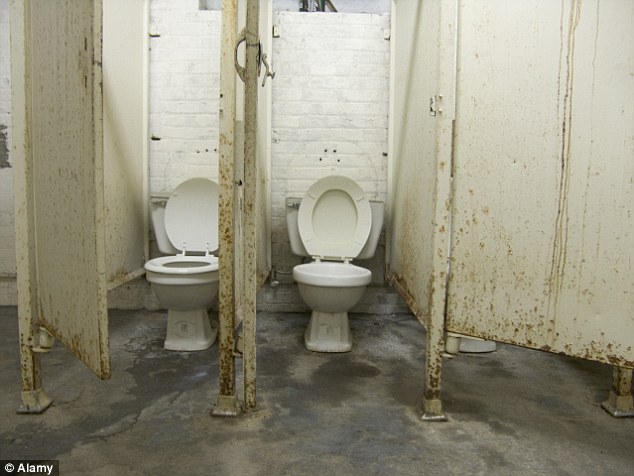
Where is `toilet lid`? This screenshot has height=476, width=634. toilet lid is located at coordinates (204, 221), (342, 225).